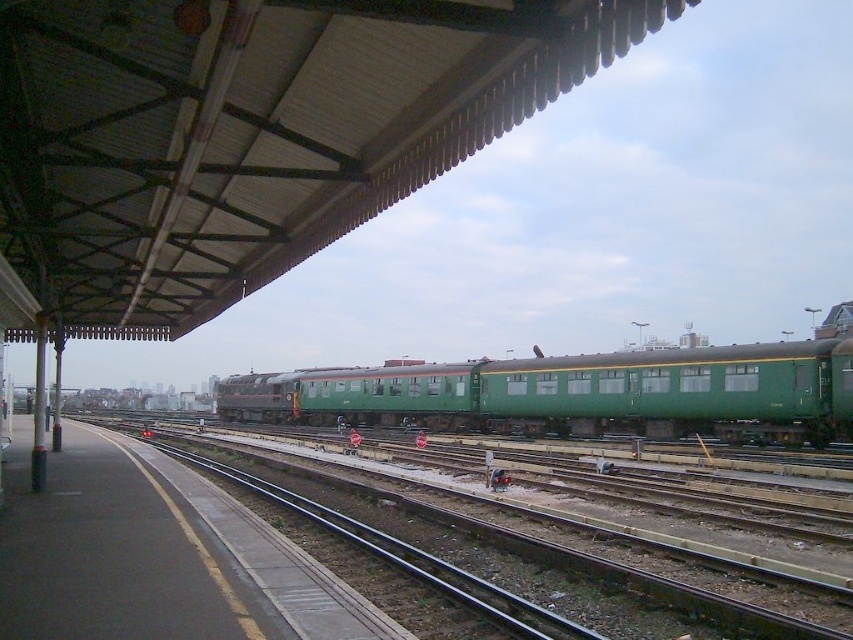
Consider the image. How far apart are green matte train car at center and green metal track at center?

green matte train car at center and green metal track at center are 64.86 feet apart from each other.

Is point (445, 404) positioned after point (682, 596)?

Yes, it is.

Where is `green matte train car at center`? This screenshot has width=853, height=640. green matte train car at center is located at coordinates (578, 394).